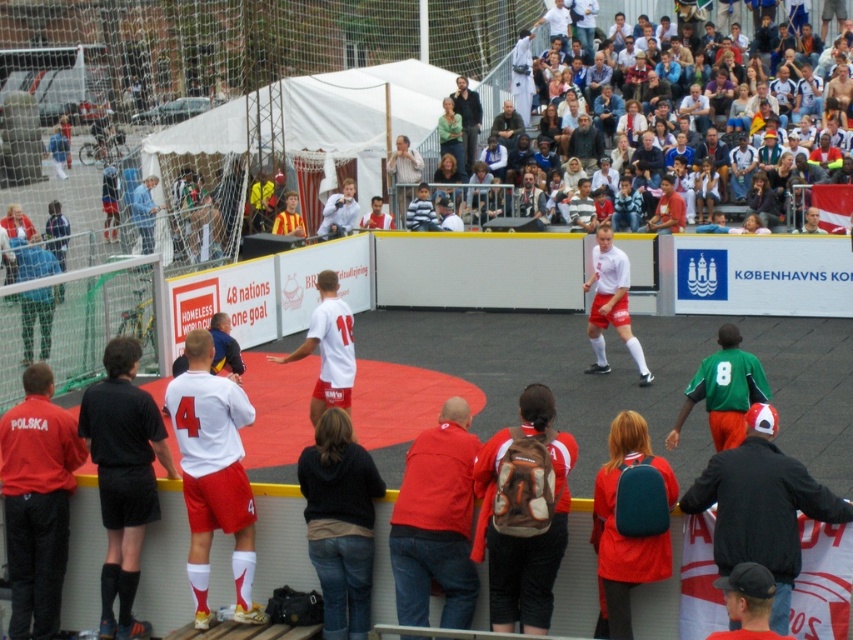
Question: Is black leather jacket at lower right to the left of matte white shirt at center from the viewer's perspective?

Choices:
 (A) yes
 (B) no

Answer: (B)

Question: Which object appears farthest from the camera in this image?

Choices:
 (A) matte white shirt at center
 (B) black matte shorts at left
 (C) multicolored casual clothing at upper center

Answer: (A)

Question: Which point is closer to the camera?

Choices:
 (A) smooth brown leather jacket at upper center
 (B) multicolored casual clothing at upper center
 (C) dark gray jacket at center
 (D) black leather jacket at lower right

Answer: (D)

Question: Is black leather jacket at lower right positioned in front of smooth brown leather jacket at upper center?

Choices:
 (A) yes
 (B) no

Answer: (A)

Question: Observing the image, what is the correct spatial positioning of black leather jacket at lower right in reference to matte white shirt at center?

Choices:
 (A) above
 (B) below

Answer: (B)

Question: Based on their relative distances, which object is nearer to the black leather jacket at lower right?

Choices:
 (A) matte white shirt at center
 (B) red matte jacket at center
 (C) dark gray jacket at center

Answer: (B)